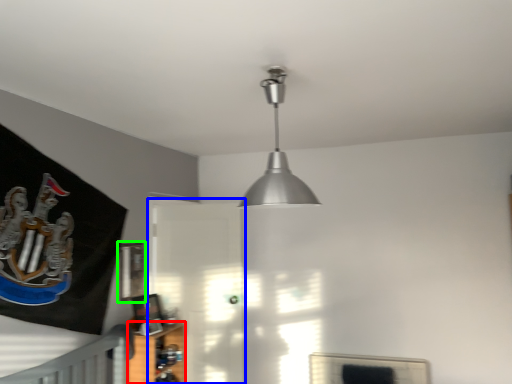
Question: Which is farther away from shelf (highlighted by a red box)? glass door (highlighted by a blue box) or picture frame (highlighted by a green box)?

Choices:
 (A) glass door
 (B) picture frame

Answer: (A)